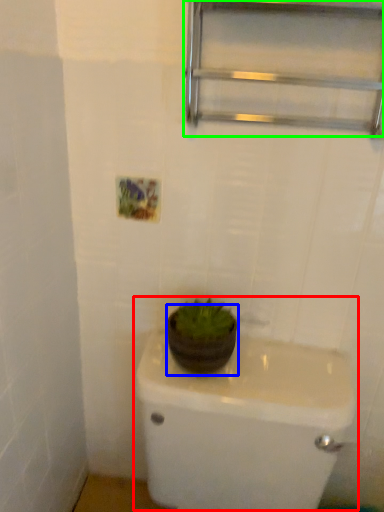
Question: Estimate the real-world distances between objects in this image. Which object is closer to sink (highlighted by a red box), flowerpot (highlighted by a blue box) or shelf (highlighted by a green box)?

Choices:
 (A) flowerpot
 (B) shelf

Answer: (A)